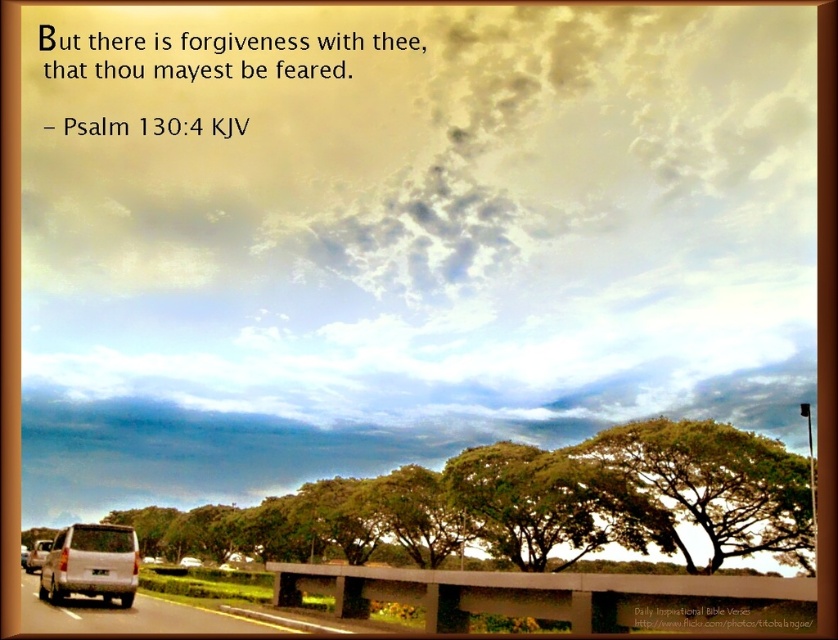
You are driving a car and see the green leafy tree at center and the silver metallic van at lower left in your view. Which vehicle is closer to you?

The silver metallic van at lower left is behind the green leafy tree at center, so the green leafy tree at center is closer to you.

You are a photographer trying to capture the metallic silver car at lower left and the green leafy tree at center in the same frame. Based on their sizes in the image, which object should you focus on first to ensure both are clearly visible?

The green leafy tree at center is smaller than the metallic silver car at lower left, so you should focus on the metallic silver car at lower left first to ensure both are clearly visible.

You are standing at the point labeled as point (91, 563) in the image. Looking around, you see a silver metallic van at lower left. What object is located at your current position?

The point (91, 563) corresponds to the silver metallic van at lower left.